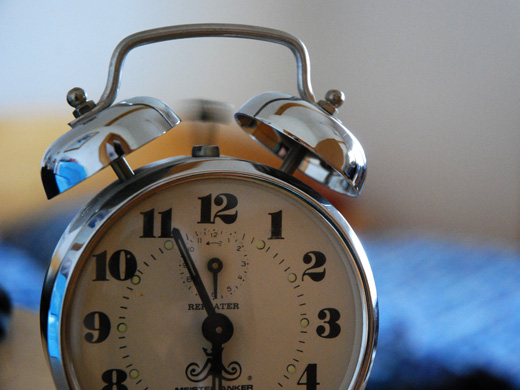
The image size is (520, 390). Find the location of `metal handle on top of bells on top of clock`. metal handle on top of bells on top of clock is located at coordinates (208, 29).